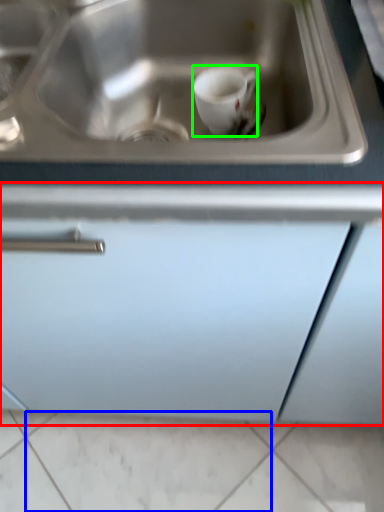
Question: Considering the real-world distances, which object is closest to cabinetry (highlighted by a red box)? tile (highlighted by a blue box) or coffee cup (highlighted by a green box).

Choices:
 (A) tile
 (B) coffee cup

Answer: (B)